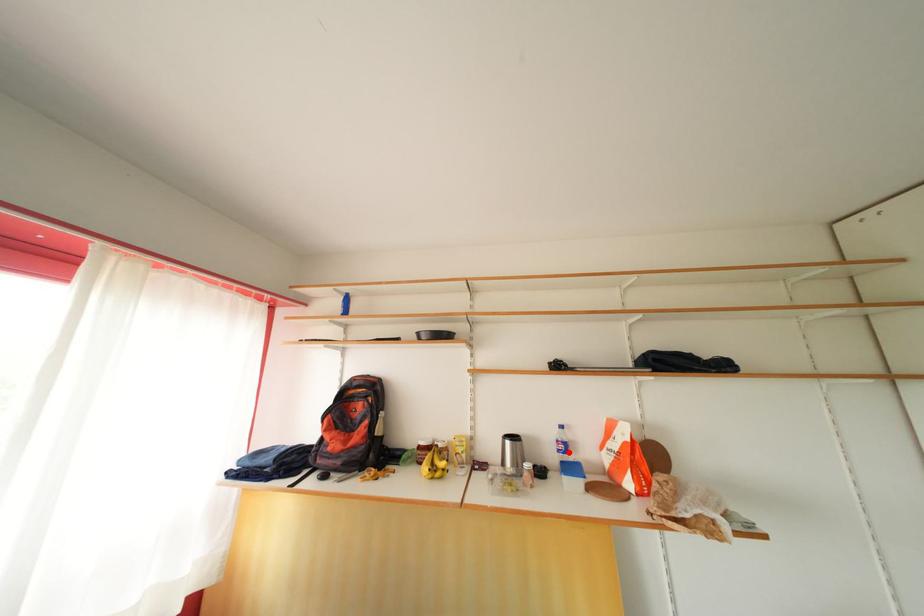
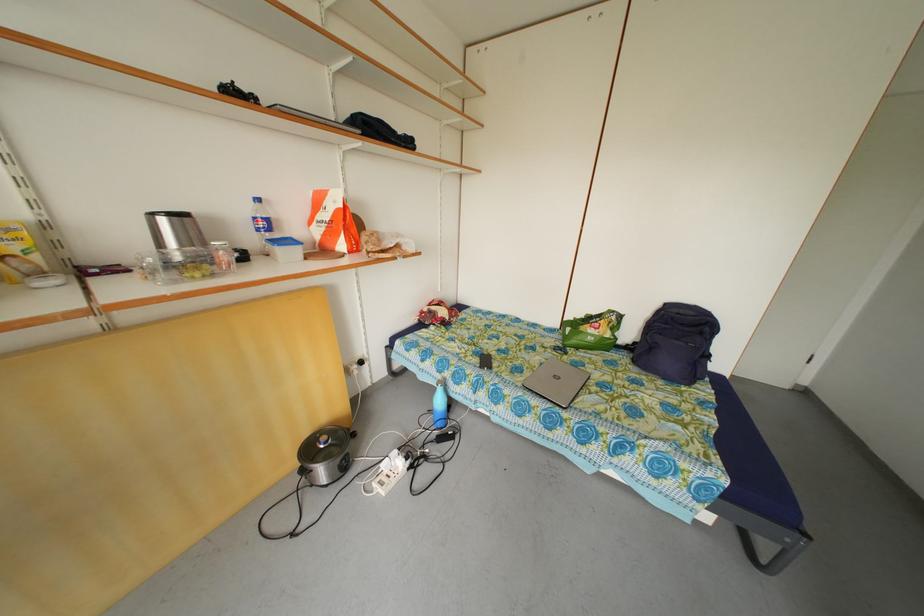
Find the pixel in the second image that matches the highlighted location in the first image.

(270, 230)